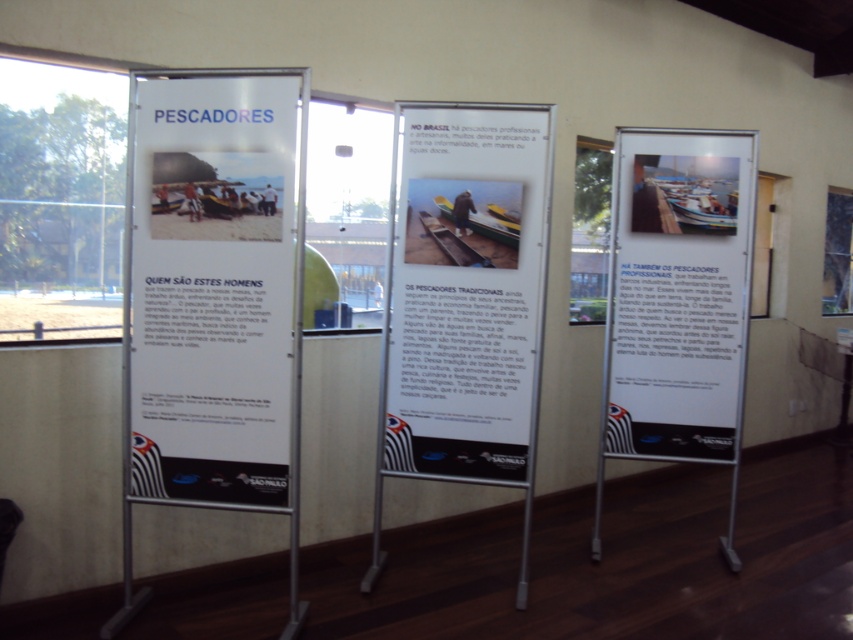
Who is higher up, matte white poster at center or matte paper poster at center?

matte white poster at center is above.

What do you see at coordinates (212, 288) in the screenshot? I see `matte white poster at center` at bounding box center [212, 288].

Where is `matte white poster at center`? This screenshot has height=640, width=853. matte white poster at center is located at coordinates (212, 288).

Between matte white poster at center and white paper poster at center, which one is positioned higher?

white paper poster at center

Does matte white poster at center come in front of white paper poster at center?

Yes, matte white poster at center is closer to the viewer.

Where is `matte white poster at center`? This screenshot has height=640, width=853. matte white poster at center is located at coordinates point(212,288).

Does matte paper poster at center have a greater height compared to white paper poster at center?

Indeed, matte paper poster at center has a greater height compared to white paper poster at center.

Does matte paper poster at center have a lesser width compared to white paper poster at center?

No, matte paper poster at center is not thinner than white paper poster at center.

What do you see at coordinates (465, 291) in the screenshot? I see `matte paper poster at center` at bounding box center [465, 291].

Identify the location of matte paper poster at center. tap(465, 291).